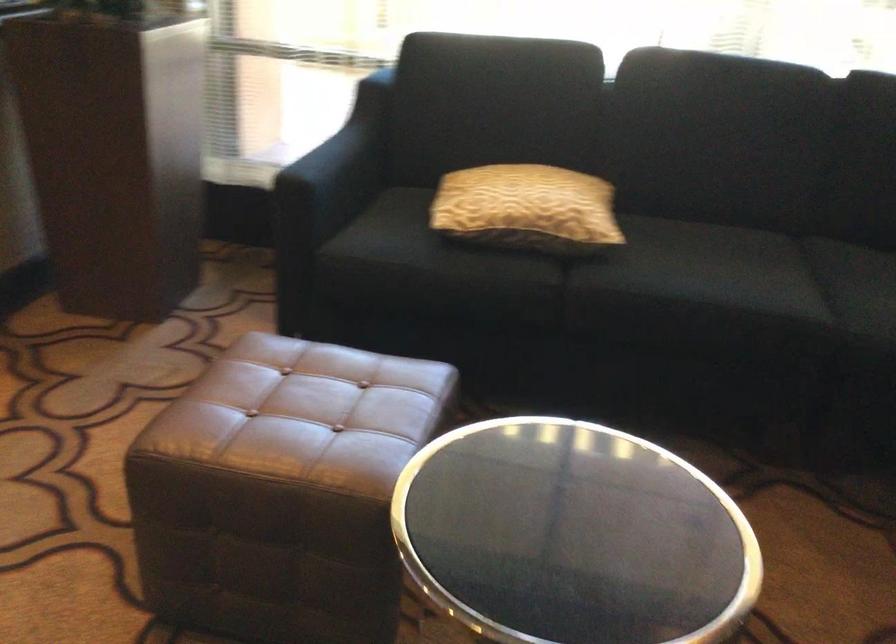
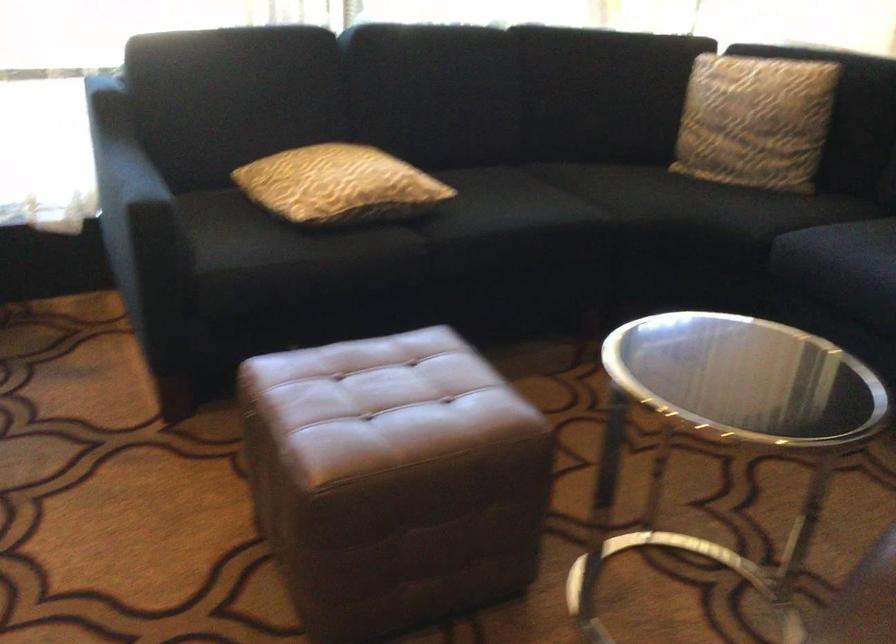
Where in the second image is the point corresponding to point (328, 138) from the first image?

(118, 162)